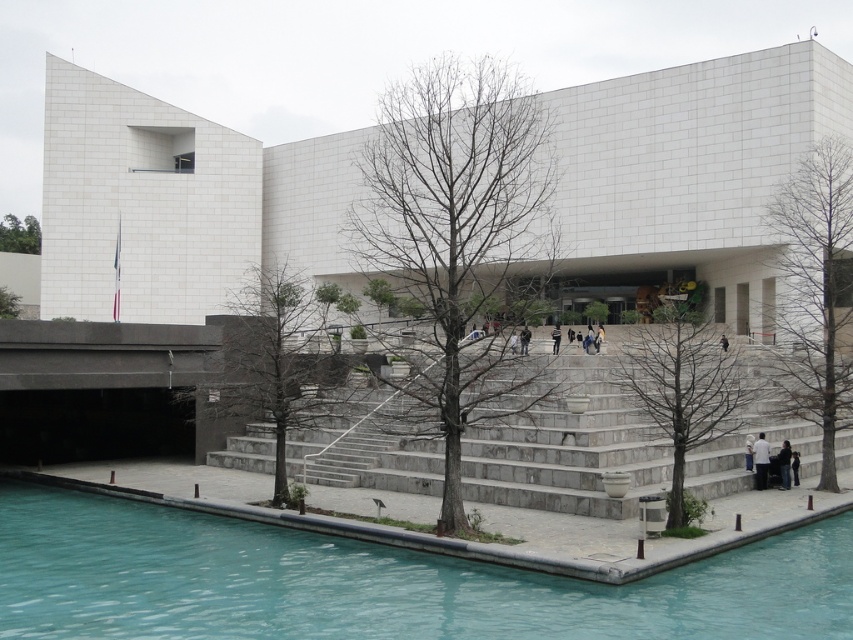
Question: Which point appears closest to the camera in this image?

Choices:
 (A) (589, 596)
 (B) (720, 342)
 (C) (271, 410)
 (D) (10, 228)

Answer: (A)

Question: Among these points, which one is nearest to the camera?

Choices:
 (A) (334, 352)
 (B) (184, 589)
 (C) (596, 387)
 (D) (523, 337)

Answer: (B)

Question: Can you confirm if clear blue water at bottom left is positioned below brown bark tree at right?

Choices:
 (A) no
 (B) yes

Answer: (B)

Question: Which of the following is the farthest from the observer?

Choices:
 (A) (16, 600)
 (B) (39, 248)
 (C) (560, 324)
 (D) (335, 348)

Answer: (B)

Question: Observing the image, what is the correct spatial positioning of bare wood tree at center in reference to dark gray concrete person at center?

Choices:
 (A) above
 (B) below

Answer: (B)

Question: Does bare branches at center appear on the left side of gray stone stairs at center?

Choices:
 (A) yes
 (B) no

Answer: (A)